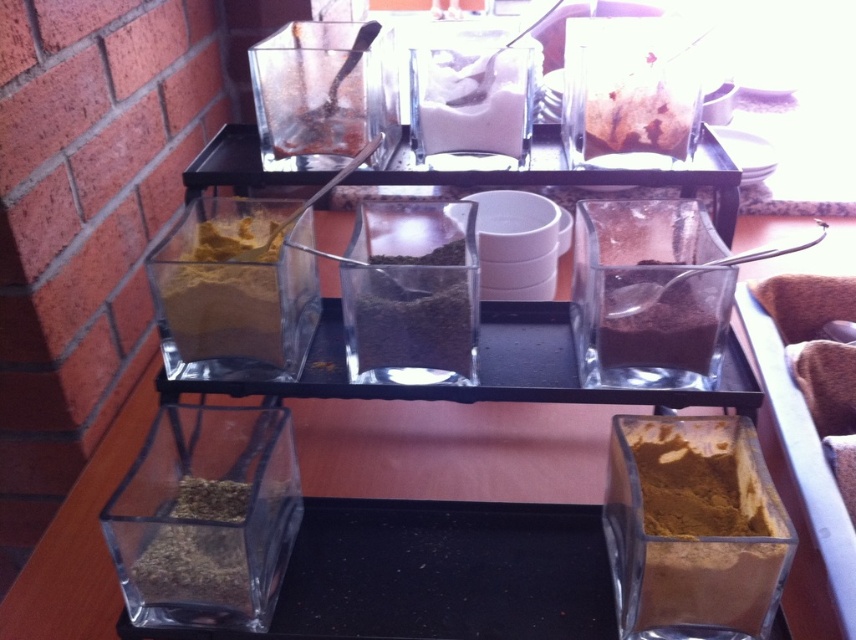
Does point (617, 589) come closer to viewer compared to point (681, 100)?

Yes, point (617, 589) is closer to viewer.

Can you confirm if yellow powder at bottom right is positioned to the left of brown crumbly spice at center?

Correct, you'll find yellow powder at bottom right to the left of brown crumbly spice at center.

Who is more distant from viewer, (688, 492) or (664, 122)?

Point (664, 122)

I want to click on yellow powder at bottom right, so click(693, 529).

Which is above, dark green granular spice at center or white powder at center?

white powder at center

Is the position of dark green granular spice at center more distant than that of white powder at center?

No, it is in front of white powder at center.

The image size is (856, 640). Describe the element at coordinates (411, 312) in the screenshot. I see `dark green granular spice at center` at that location.

At what (x,y) coordinates should I click in order to perform the action: click on dark green granular spice at center. Please return your answer as a coordinate pair (x, y). The image size is (856, 640). Looking at the image, I should click on (411, 312).

Does yellow powder at center have a lesser height compared to dark brown powder at center?

Incorrect, yellow powder at center's height does not fall short of dark brown powder at center's.

Between yellow powder at center and dark brown powder at center, which one has more height?

yellow powder at center

Find the location of a particular element. The height and width of the screenshot is (640, 856). yellow powder at center is located at coordinates (223, 310).

Where is `yellow powder at center`? yellow powder at center is located at coordinates (223, 310).